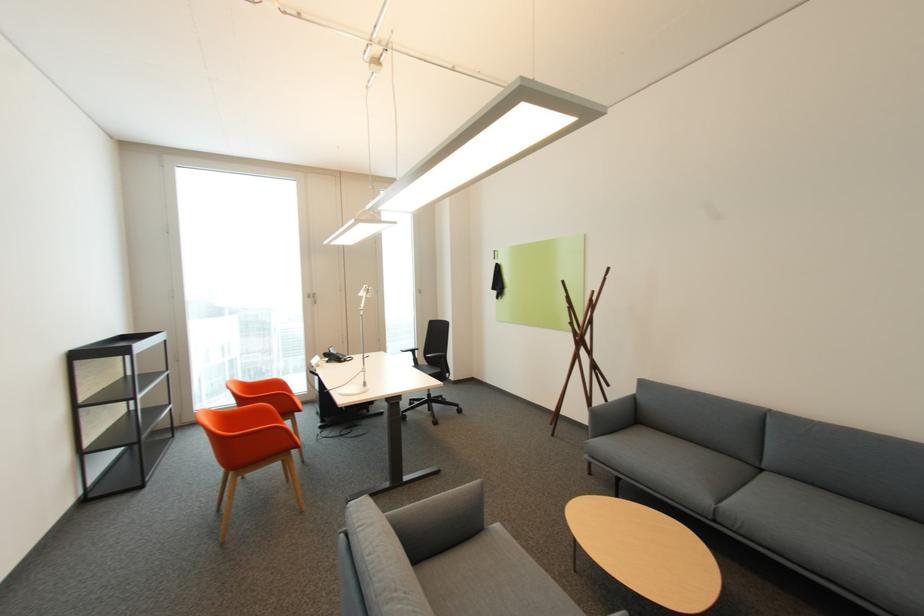
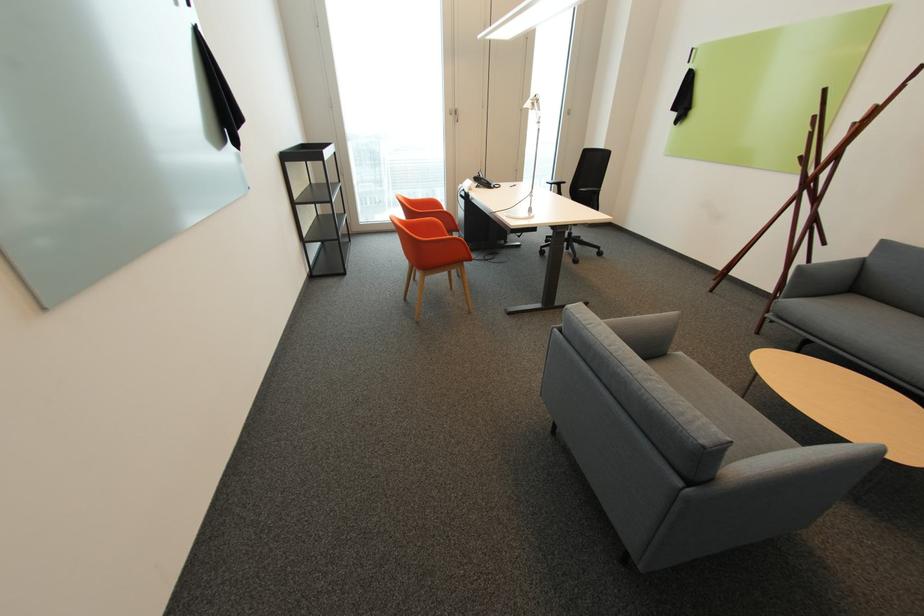
Where in the second image is the point corresponding to (366,294) from the first image?

(531, 107)